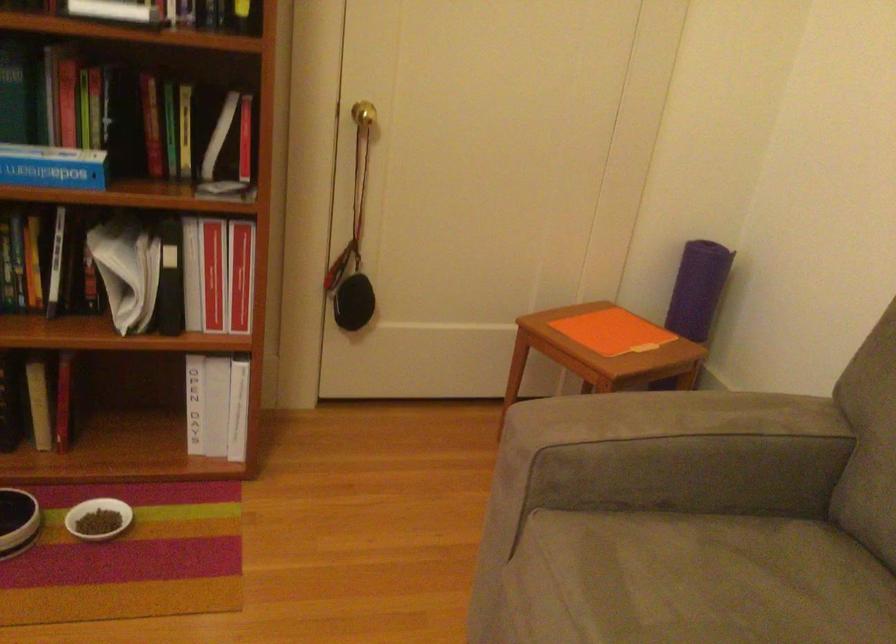
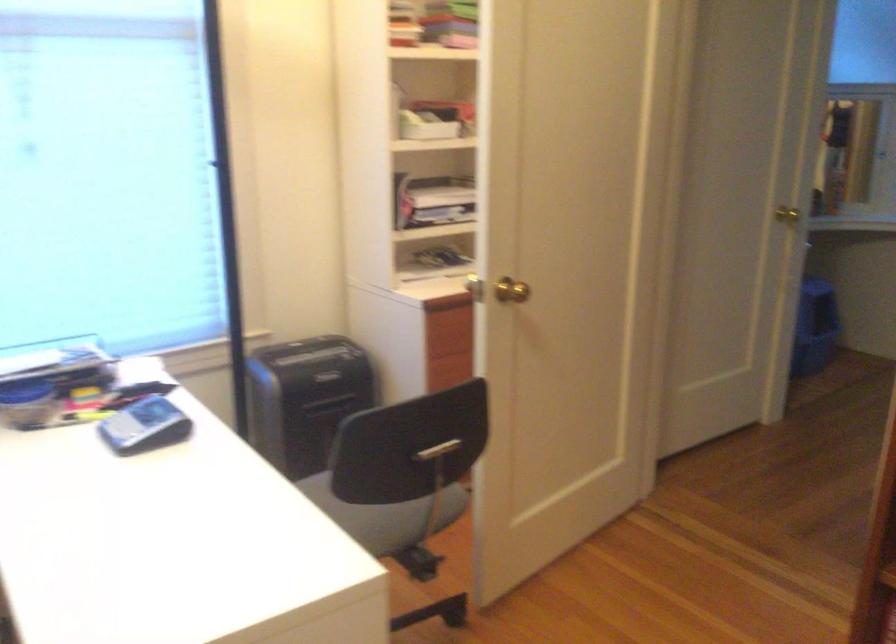
Question: The camera is either moving clockwise (left) or counter-clockwise (right) around the object. The first image is from the beginning of the video and the second image is from the end. Is the camera moving left or right when shooting the video?

Choices:
 (A) Left
 (B) Right

Answer: (B)